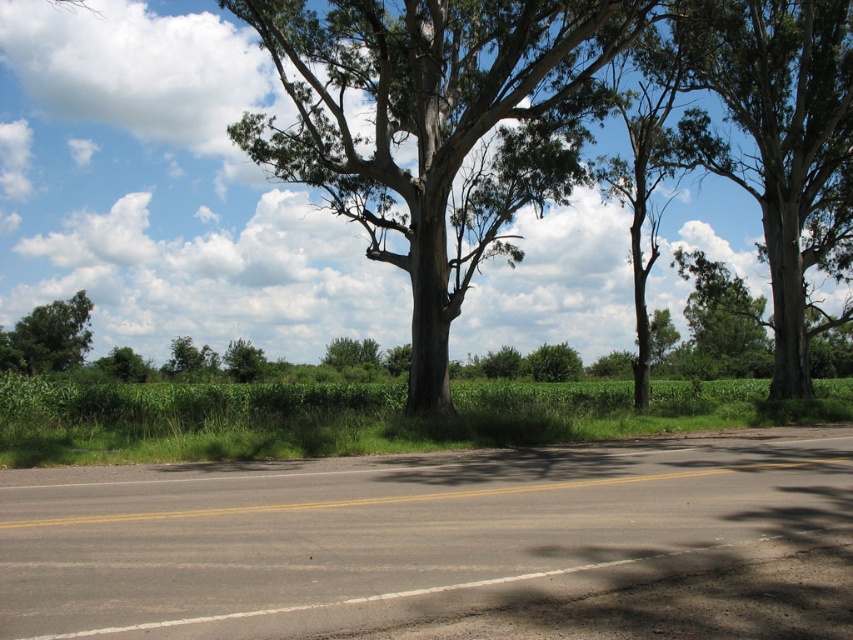
What do you see at coordinates (779, 147) in the screenshot?
I see `green rough bark tree at upper right` at bounding box center [779, 147].

Describe the element at coordinates (779, 147) in the screenshot. I see `green rough bark tree at upper right` at that location.

Locate an element on the screen. The image size is (853, 640). green rough bark tree at upper right is located at coordinates (779, 147).

Can you confirm if green leafy tree at upper right is positioned below green matte tree at center?

No.

Between green leafy tree at upper right and green matte tree at center, which one is positioned higher?

green leafy tree at upper right

Image resolution: width=853 pixels, height=640 pixels. Describe the element at coordinates (724, 316) in the screenshot. I see `green leafy tree at upper right` at that location.

The image size is (853, 640). I want to click on green leafy tree at upper right, so click(x=724, y=316).

Looking at this image, is green rough bark tree at upper right shorter than green leafy tree at left?

No, green rough bark tree at upper right is not shorter than green leafy tree at left.

Who is shorter, green rough bark tree at upper right or green leafy tree at left?

With less height is green leafy tree at left.

Is point (827, 314) farther from camera compared to point (59, 348)?

No, it is in front of (59, 348).

The image size is (853, 640). I want to click on green rough bark tree at upper right, so click(x=779, y=147).